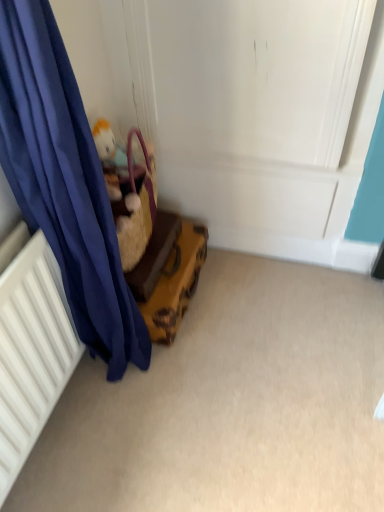
This screenshot has width=384, height=512. What do you see at coordinates (168, 274) in the screenshot?
I see `wooden suitcase at lower left` at bounding box center [168, 274].

At what (x,y) coordinates should I click in order to perform the action: click on wooden suitcase at lower left. Please return your answer as a coordinate pair (x, y). The width and height of the screenshot is (384, 512). Looking at the image, I should click on (168, 274).

This screenshot has height=512, width=384. Find the location of `wooden suitcase at lower left`. wooden suitcase at lower left is located at coordinates (168, 274).